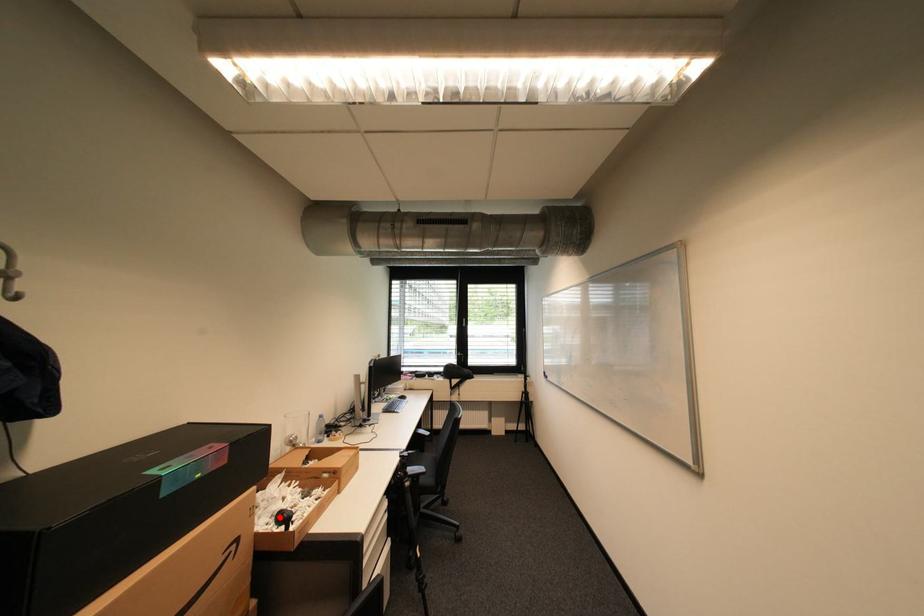
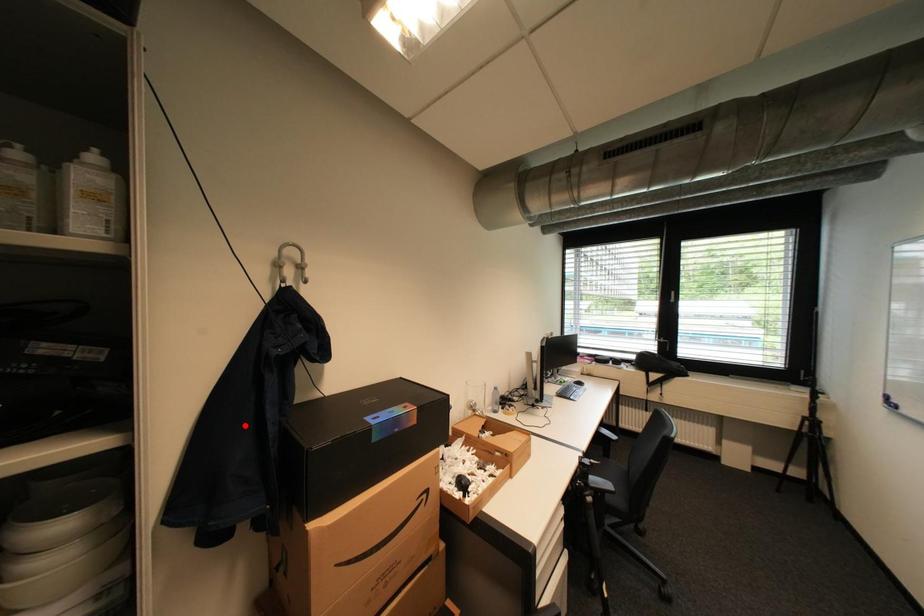
I am providing you with two images of the same scene from different viewpoints. A red point is marked on the first image and another point is marked on the second image. Does the point marked in image1 correspond to the same location as the one in image2?

No